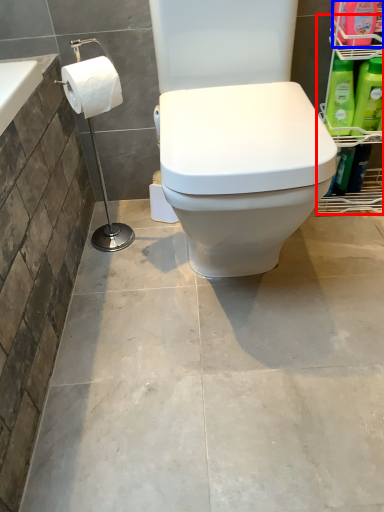
Question: Which object is closer to the camera taking this photo, shelf (highlighted by a red box) or cleaning product (highlighted by a blue box)?

Choices:
 (A) shelf
 (B) cleaning product

Answer: (A)